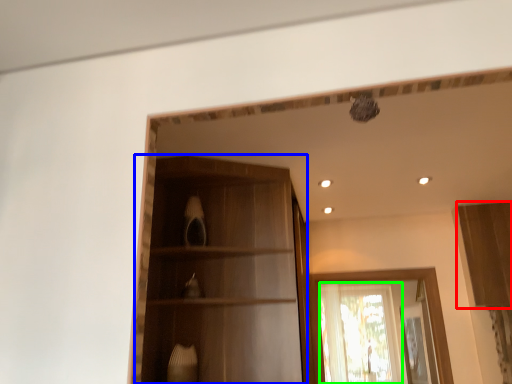
Question: Based on their relative distances, which object is nearer to cabinetry (highlighted by a red box)? Choose from cabinetry (highlighted by a blue box) and window (highlighted by a green box).

Choices:
 (A) cabinetry
 (B) window

Answer: (B)